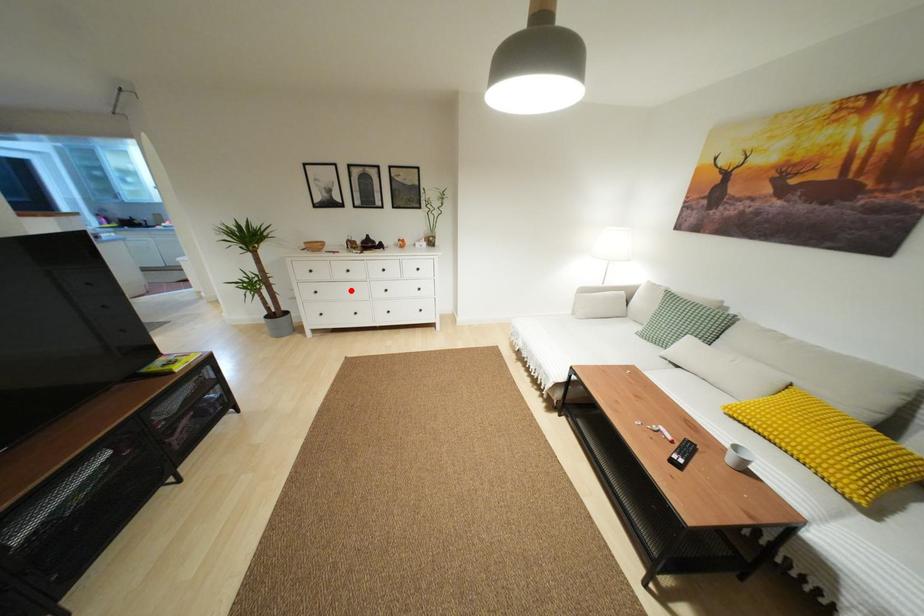
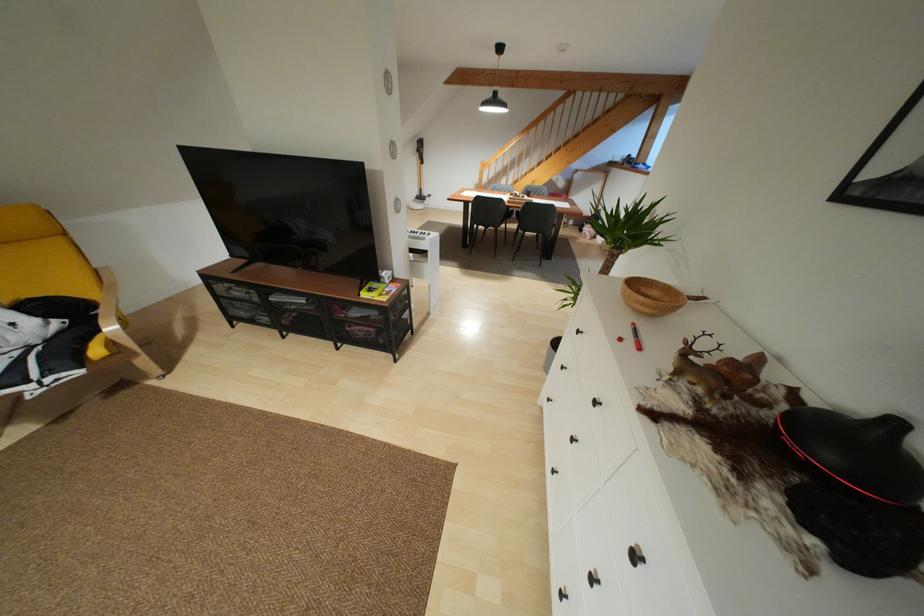
In the second image, find the point that corresponds to the highlighted location in the first image.

(572, 439)